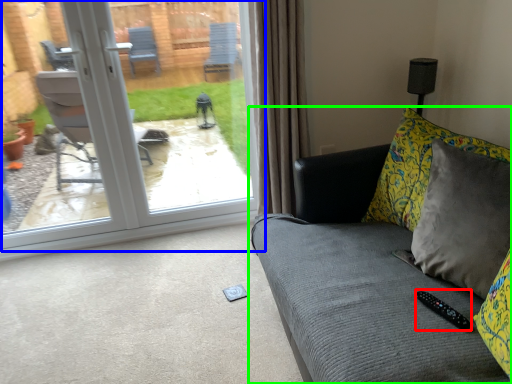
Question: Based on their relative distances, which object is nearer to remote (highlighted by a red box)? Choose from door (highlighted by a blue box) and studio couch (highlighted by a green box).

Choices:
 (A) door
 (B) studio couch

Answer: (B)